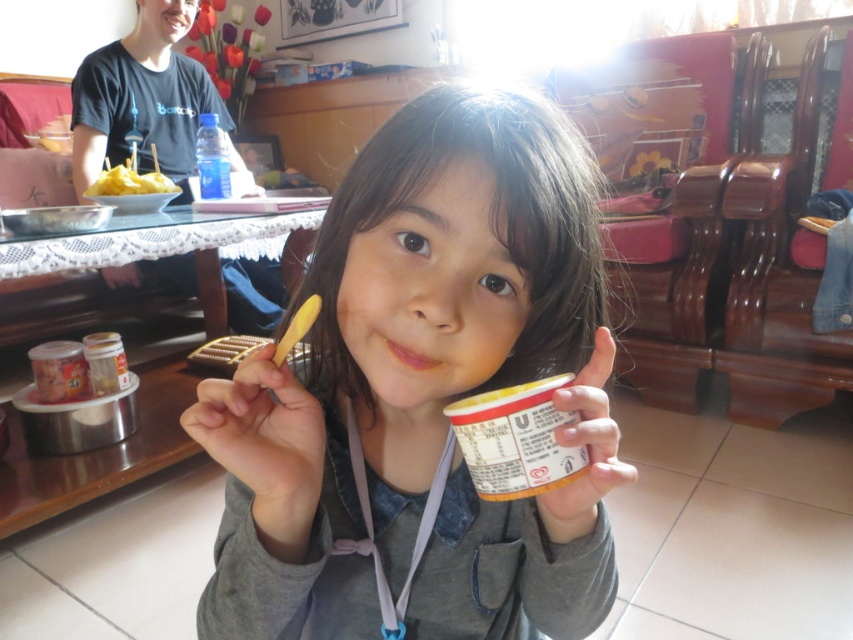
You are standing in the room and want to place a new decorative item. There are two points marked in the image. Which point is closer to you, point (518, 188) or point (119, 173)?

Point (518, 188) is closer to the viewer than point (119, 173), so you should place the decorative item there if you want it closer.

You are a photographer trying to capture the matte gray sweater at center and the yellow matte food at left in a single shot. Since you can only focus on one subject at a time, which one should you choose to ensure the other remains in the background?

You should focus on the matte gray sweater at center because it is in front of the yellow matte food at left, so the sweater will be in focus while the food stays in the background.

You are a photographer setting up a shot of the scene. You need to ensure that the matte gray sweater at center and the yellow matte food at left are both in focus. Given that the depth of field can only cover objects within a 10cm height difference, will both items stay in focus?

The matte gray sweater at center is taller than the yellow matte food at left. Since the height difference is within the 10cm depth of field, both items will remain in focus.